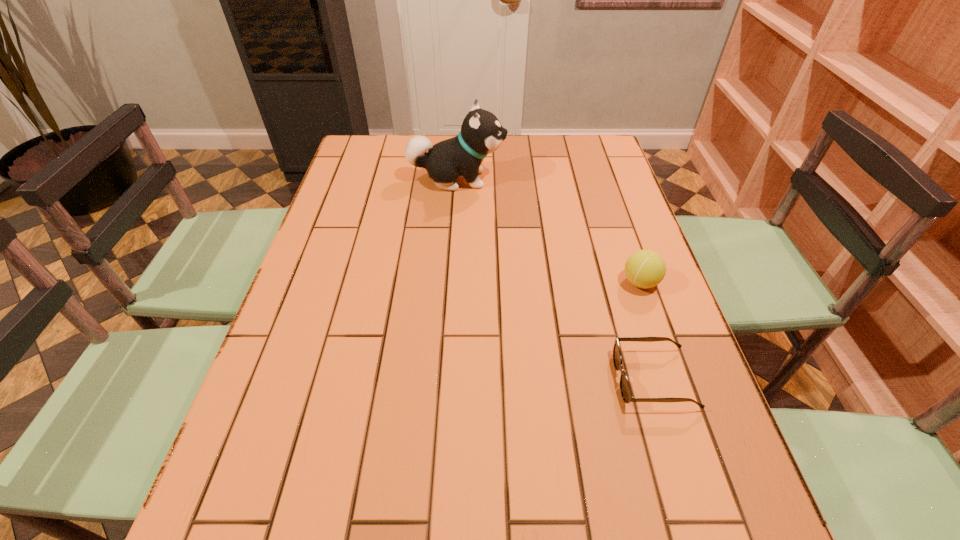
This screenshot has height=540, width=960. In order to click on free space that satisfies the following two spatial constraints: 1. at the face of the tennis ball; 2. on the right side of the puppy in this screenshot , I will do `click(450, 282)`.

What are the coordinates of `free location that satisfies the following two spatial constraints: 1. at the face of the leftmost object; 2. on the right side of the second nearest object` in the screenshot? It's located at (450, 282).